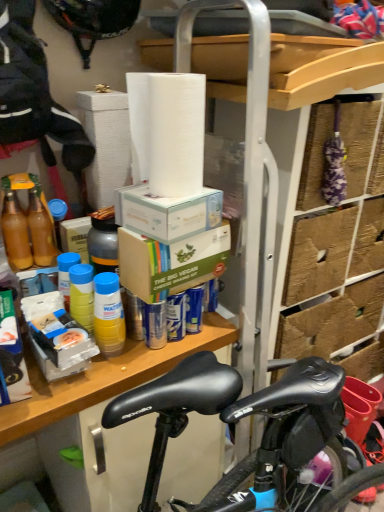
Identify the location of vacant space situated above white cardboard box at upper center, which is the first box from top to bottom (from a real-world perspective). This screenshot has height=512, width=384. (160, 192).